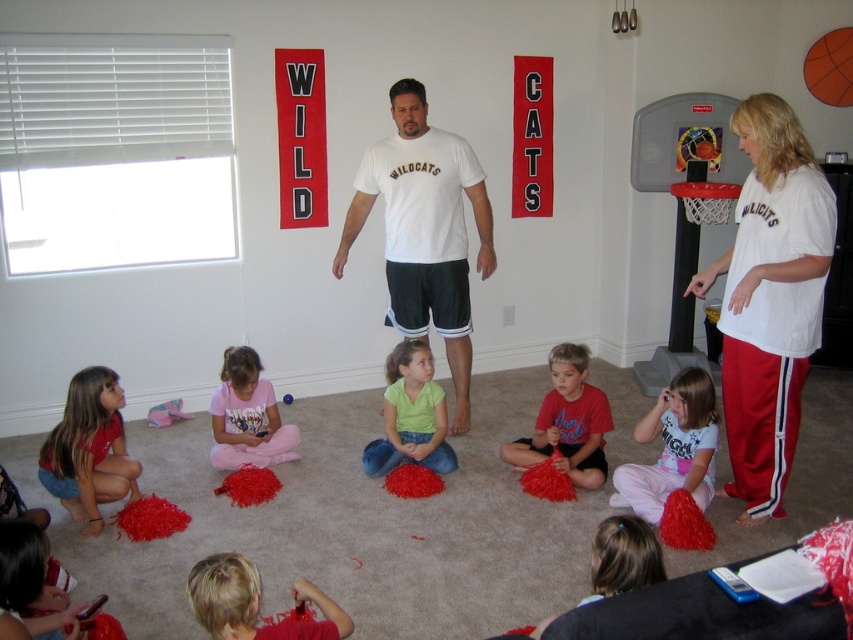
Is white matte t-shirt at center wider than pink cotton shirt at center?

Yes, white matte t-shirt at center is wider than pink cotton shirt at center.

Is white matte t-shirt at center bigger than pink cotton shirt at center?

Correct, white matte t-shirt at center is larger in size than pink cotton shirt at center.

Measure the distance between point (357,216) and camera.

A distance of 4.15 meters exists between point (357,216) and camera.

I want to click on white matte t-shirt at center, so click(425, 230).

Is pink cotton shirt at center to the left of red matte pom-pom at center from the viewer's perspective?

No, pink cotton shirt at center is not to the left of red matte pom-pom at center.

Find the location of a particular element. Image resolution: width=853 pixels, height=640 pixels. pink cotton shirt at center is located at coordinates (672, 448).

In the scene shown: Does green matte shirt at center appear under orange matte basketball at upper right?

Correct, green matte shirt at center is located below orange matte basketball at upper right.

Can you confirm if green matte shirt at center is wider than orange matte basketball at upper right?

Yes.

Does point (410, 416) lie behind point (836, 40)?

No, it is in front of (836, 40).

In order to click on green matte shirt at center in this screenshot , I will do [x=410, y=416].